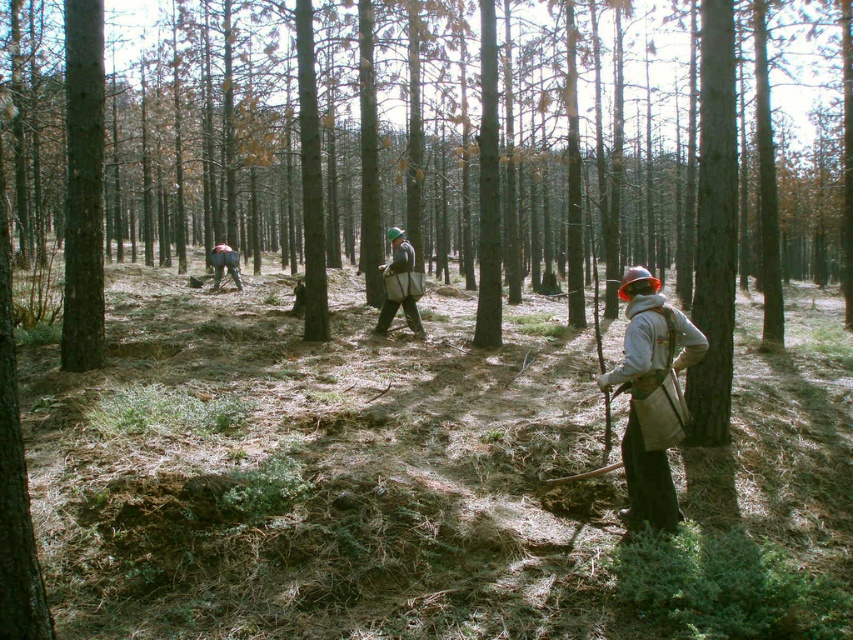
Question: Is gray fabric shirt at center wider than matte gray jacket at center?

Choices:
 (A) yes
 (B) no

Answer: (B)

Question: Which point is farther to the camera?

Choices:
 (A) (677, 390)
 (B) (93, 234)
 (C) (219, 264)

Answer: (C)

Question: Among these points, which one is farthest from the camera?

Choices:
 (A) (659, 513)
 (B) (397, 228)

Answer: (B)

Question: Is gray fabric shirt at center positioned in front of dark gray uniform at center?

Choices:
 (A) yes
 (B) no

Answer: (A)

Question: Which point is closer to the camera taking this photo?

Choices:
 (A) (677, 422)
 (B) (64, 8)
 (C) (404, 244)

Answer: (A)

Question: Can you confirm if gray fabric shirt at center is positioned to the right of dark gray uniform at center?

Choices:
 (A) yes
 (B) no

Answer: (A)